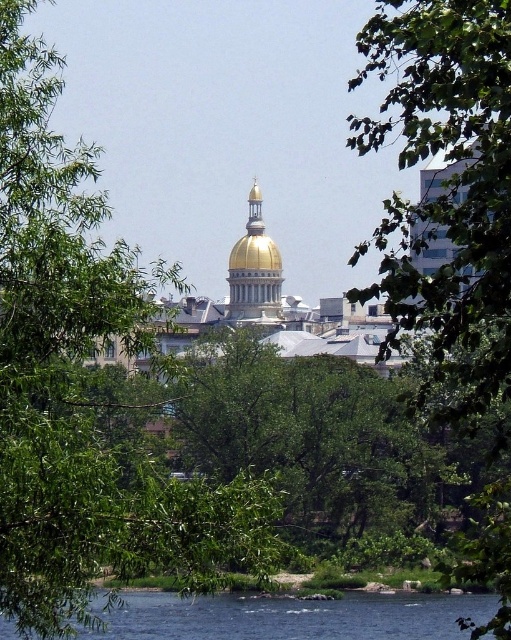
Question: Considering the real-world distances, which object is closest to the blue water at lower center?

Choices:
 (A) green leafy tree at center
 (B) green leafy tree at left
 (C) gold polished dome at center

Answer: (A)

Question: Can you confirm if green leafy tree at left is wider than green leafy tree at center?

Choices:
 (A) yes
 (B) no

Answer: (B)

Question: Which object is positioned farthest from the green leafy tree at center?

Choices:
 (A) blue water at lower center
 (B) gold polished dome at center
 (C) green leafy tree at left

Answer: (B)

Question: Is green leafy tree at center positioned in front of gold polished dome at center?

Choices:
 (A) no
 (B) yes

Answer: (B)

Question: Does green leafy tree at left have a greater width compared to gold polished dome at center?

Choices:
 (A) yes
 (B) no

Answer: (A)

Question: Which point is closer to the camera?

Choices:
 (A) green leafy tree at center
 (B) gold polished dome at center
 (C) blue water at lower center

Answer: (A)